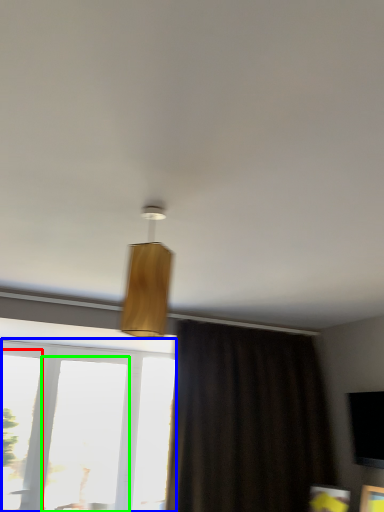
Question: Based on their relative distances, which object is farther from window (highlighted by a red box)? Choose from window (highlighted by a blue box) and window (highlighted by a green box).

Choices:
 (A) window
 (B) window

Answer: (B)